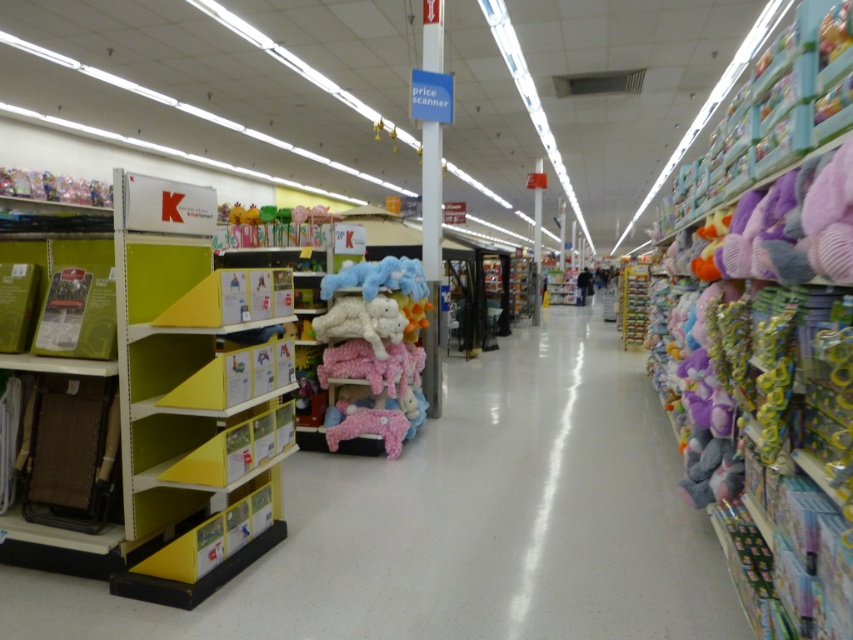
Is fluffy plush toys at right to the right of pastel plush toys at center from the viewer's perspective?

Indeed, fluffy plush toys at right is positioned on the right side of pastel plush toys at center.

Is fluffy plush toys at right thinner than pastel plush toys at center?

Incorrect, fluffy plush toys at right's width is not less than pastel plush toys at center's.

Does point (815, 42) come closer to viewer compared to point (316, 218)?

Yes.

The height and width of the screenshot is (640, 853). Find the location of `fluffy plush toys at right`. fluffy plush toys at right is located at coordinates (770, 330).

Does fluffy plush toys at right appear under dark blue jacket at center?

Yes.

Who is shorter, fluffy plush toys at right or dark blue jacket at center?

With less height is dark blue jacket at center.

Between point (770, 184) and point (583, 269), which one is positioned in front?

Point (770, 184)

Locate an element on the screen. This screenshot has width=853, height=640. fluffy plush toys at right is located at coordinates (770, 330).

Which is more to the left, fluffy pink plush at center or metallic silver toy at center?

fluffy pink plush at center is more to the left.

The height and width of the screenshot is (640, 853). I want to click on fluffy pink plush at center, so click(374, 352).